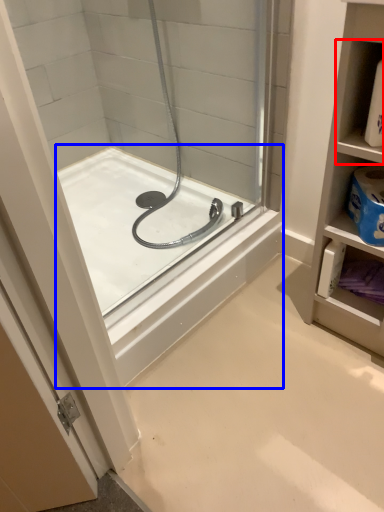
Question: Which of the following is the closest to the observer, shelf (highlighted by a red box) or bathtub (highlighted by a blue box)?

Choices:
 (A) shelf
 (B) bathtub

Answer: (A)